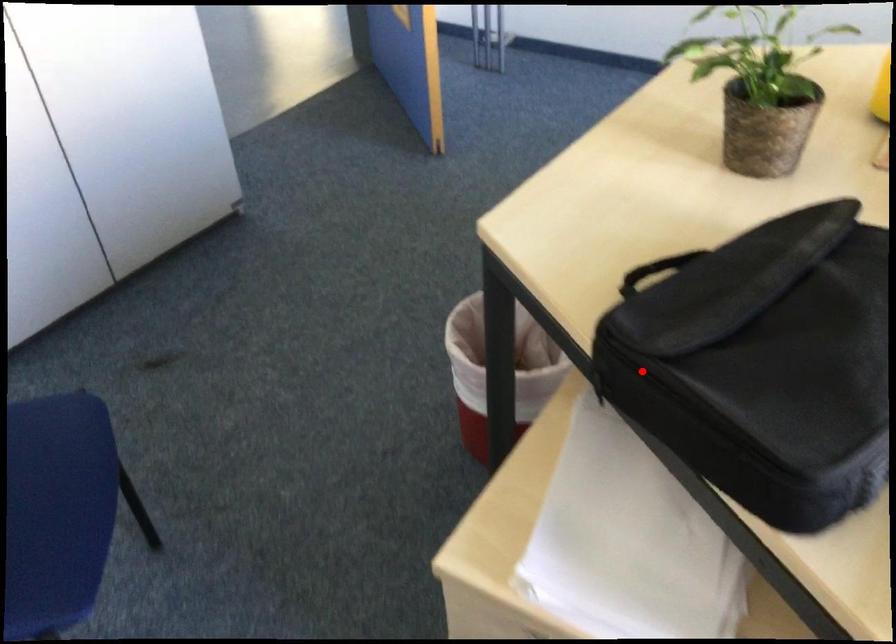
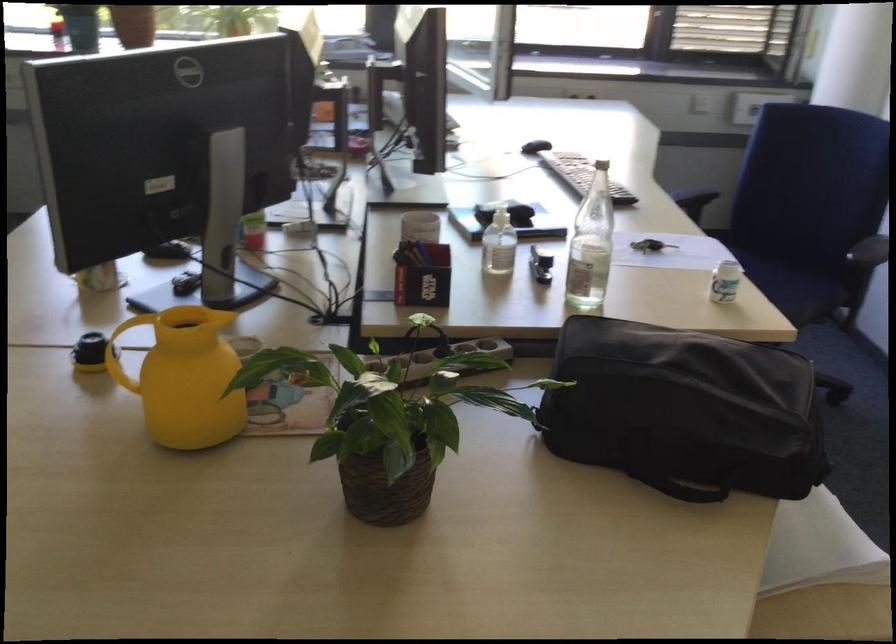
Where in the second image is the point corresponding to the highlighted location from the first image?

(694, 491)